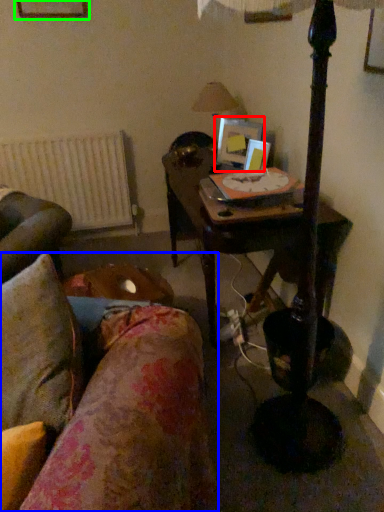
Question: Based on their relative distances, which object is nearer to picture frame (highlighted by a red box)? Choose from studio couch (highlighted by a blue box) and picture frame (highlighted by a green box).

Choices:
 (A) studio couch
 (B) picture frame

Answer: (B)